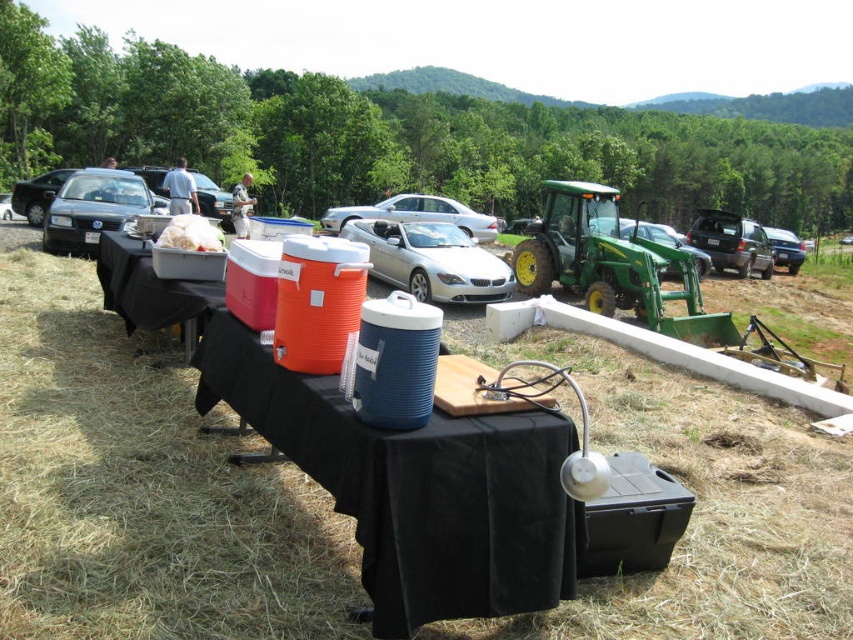
The height and width of the screenshot is (640, 853). I want to click on green plastic tractor at right, so click(611, 264).

Is green plastic tractor at right thinner than matte black car at left?

No, green plastic tractor at right is not thinner than matte black car at left.

Where is `green plastic tractor at right`? This screenshot has width=853, height=640. green plastic tractor at right is located at coordinates (611, 264).

The width and height of the screenshot is (853, 640). What are the coordinates of `green plastic tractor at right` in the screenshot? It's located at (611, 264).

Between silver metallic car at center and matte black car at left, which one appears on the left side from the viewer's perspective?

matte black car at left is more to the left.

Between silver metallic car at center and matte black car at left, which one has more height?

Standing taller between the two is matte black car at left.

Find the location of a particular element. The width and height of the screenshot is (853, 640). silver metallic car at center is located at coordinates (431, 260).

Looking at this image, is green plastic tractor at right thinner than silver metallic car at center?

Yes, green plastic tractor at right is thinner than silver metallic car at center.

Who is more distant from viewer, (611, 259) or (416, 289)?

The point (416, 289) is more distant.

Is point (624, 298) behind point (480, 256)?

No, (624, 298) is in front of (480, 256).

Where is `green plastic tractor at right`? This screenshot has width=853, height=640. green plastic tractor at right is located at coordinates (611, 264).